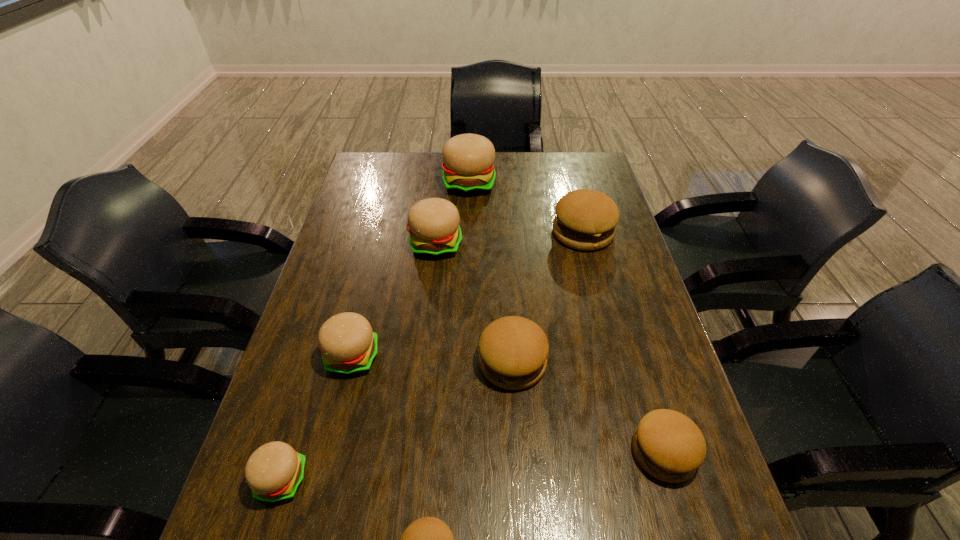
This screenshot has height=540, width=960. What are the coordinates of `the tallest hamburger` in the screenshot? It's located at (468, 169).

The height and width of the screenshot is (540, 960). In order to click on the biggest beige hamburger in this screenshot , I will do `click(468, 169)`.

The height and width of the screenshot is (540, 960). Identify the location of the third smallest beige hamburger. (433, 223).

You are a GUI agent. You are given a task and a screenshot of the screen. Output one action in this format:
    pyautogui.click(x=<x>, y=<y>)
    Task: Click on the biggest brown hamburger
    Image resolution: width=960 pixels, height=540 pixels.
    Given the screenshot: What is the action you would take?
    pyautogui.click(x=585, y=219)

This screenshot has width=960, height=540. In order to click on the third biggest beige hamburger in this screenshot , I will do `click(349, 346)`.

You are a GUI agent. You are given a task and a screenshot of the screen. Output one action in this format:
    pyautogui.click(x=<x>, y=<y>)
    Task: Click on the third smallest brown hamburger
    Image resolution: width=960 pixels, height=540 pixels.
    Given the screenshot: What is the action you would take?
    pyautogui.click(x=513, y=351)

Where is `the second farthest brown hamburger`? the second farthest brown hamburger is located at coordinates (513, 351).

Image resolution: width=960 pixels, height=540 pixels. Find the location of `the third biggest brown hamburger`. the third biggest brown hamburger is located at coordinates (668, 445).

This screenshot has height=540, width=960. In order to click on the nearest beige hamburger in this screenshot , I will do `click(274, 471)`.

This screenshot has height=540, width=960. What are the coordinates of `blank space located 0.070m on the right of the tallest object` in the screenshot? It's located at pos(515,184).